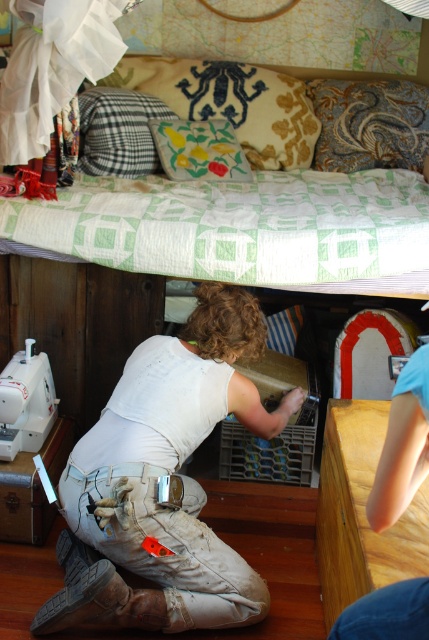
Question: Does checkered fabric pillow at upper left appear on the right side of floral fabric cushion at upper center?

Choices:
 (A) no
 (B) yes

Answer: (A)

Question: Which point is farther from the camera taking this photo?

Choices:
 (A) (157, 72)
 (B) (12, 380)
 (C) (413, 368)
 (D) (168, 116)

Answer: (A)

Question: Which point is farther from the camera taking this photo?

Choices:
 (A) (202, 193)
 (B) (398, 456)
 (C) (24, 392)

Answer: (A)

Question: Which point is closer to the camera?

Choices:
 (A) white cotton shirt at center
 (B) yellow fabric pillow at upper center

Answer: (A)

Question: Is white cotton shirt at center wider than yellow fabric pillow at upper center?

Choices:
 (A) no
 (B) yes

Answer: (A)

Question: Is yellow fabric pillow at upper center further to the viewer compared to wooden table at lower right?

Choices:
 (A) yes
 (B) no

Answer: (A)